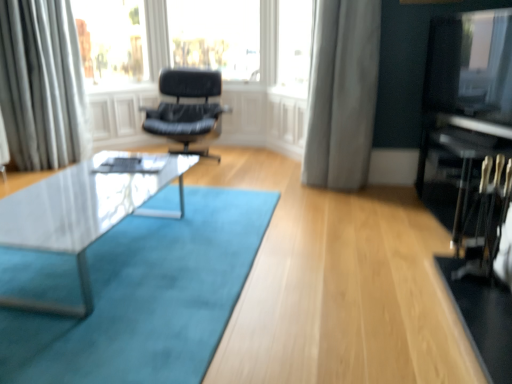
Question: Is transparent glass at upper left situated inside black leather chair at center or outside?

Choices:
 (A) inside
 (B) outside

Answer: (B)

Question: Is transparent glass at upper left to the left or to the right of black leather chair at center in the image?

Choices:
 (A) left
 (B) right

Answer: (A)

Question: Considering the real-world distances, which object is farthest from the silky white curtain at upper left, which is counted as the 1th curtain, starting from the left?

Choices:
 (A) black leather chair at center
 (B) white glossy coffee table at center
 (C) transparent glass at upper left
 (D) gray fabric curtain at center, the first curtain from the right
 (E) black glossy entertainment center at right

Answer: (E)

Question: Which object is positioned farthest from the clear glass window at upper center?

Choices:
 (A) black glossy entertainment center at right
 (B) white glossy coffee table at center
 (C) gray fabric curtain at center, the second curtain positioned from the left
 (D) transparent glass at upper left
 (E) black leather chair at center

Answer: (B)